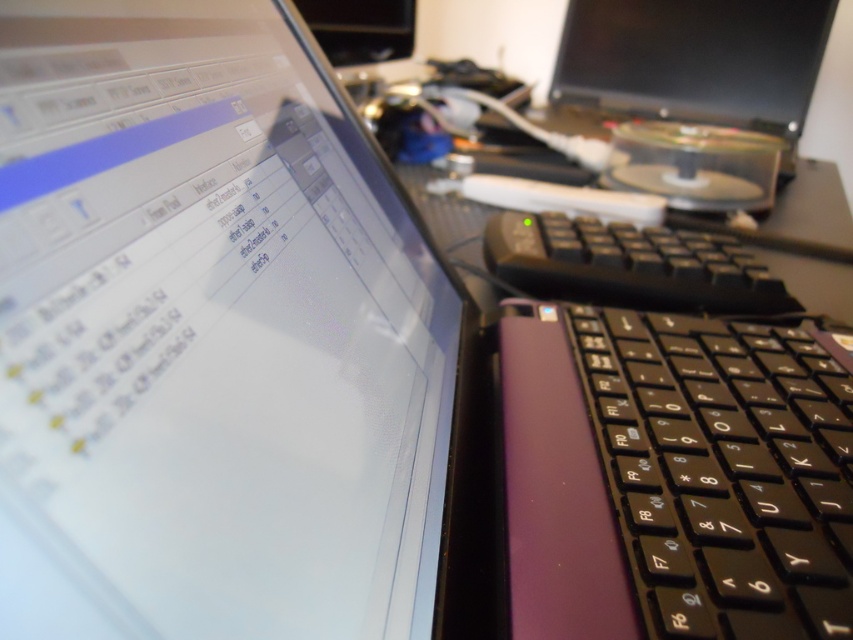
Which is above, satin black laptop at upper left or purple matte keyboard at center?

satin black laptop at upper left is above.

Is satin black laptop at upper left to the left of purple matte keyboard at center from the viewer's perspective?

Yes, satin black laptop at upper left is to the left of purple matte keyboard at center.

Between point (260, 276) and point (685, 372), which one is positioned behind?

The point (685, 372) is behind.

Locate an element on the screen. The height and width of the screenshot is (640, 853). satin black laptop at upper left is located at coordinates (210, 337).

Between purple matte keyboard at center and matte black monitor at upper center, which one appears on the right side from the viewer's perspective?

From the viewer's perspective, purple matte keyboard at center appears more on the right side.

Who is more forward, (807,365) or (376,54)?

Positioned in front is point (807,365).

Where is `purple matte keyboard at center`? This screenshot has height=640, width=853. purple matte keyboard at center is located at coordinates (668, 440).

Looking at this image, who is shorter, matte black monitor at upper right or black plastic keyboard at right?

With less height is black plastic keyboard at right.

This screenshot has height=640, width=853. I want to click on matte black monitor at upper right, so click(694, 60).